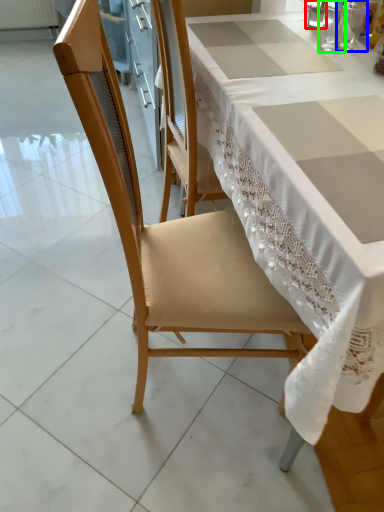
Question: Estimate the real-world distances between objects in this image. Which object is farther from tableware (highlighted by a red box), tableware (highlighted by a blue box) or tableware (highlighted by a green box)?

Choices:
 (A) tableware
 (B) tableware

Answer: (A)